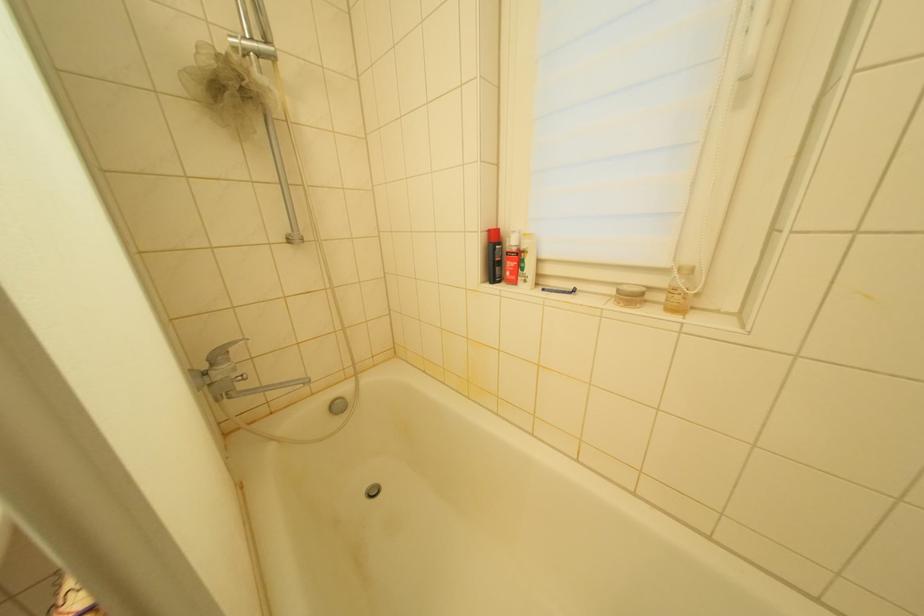
Where is `window blind cord`? Image resolution: width=924 pixels, height=616 pixels. window blind cord is located at coordinates 711,196.